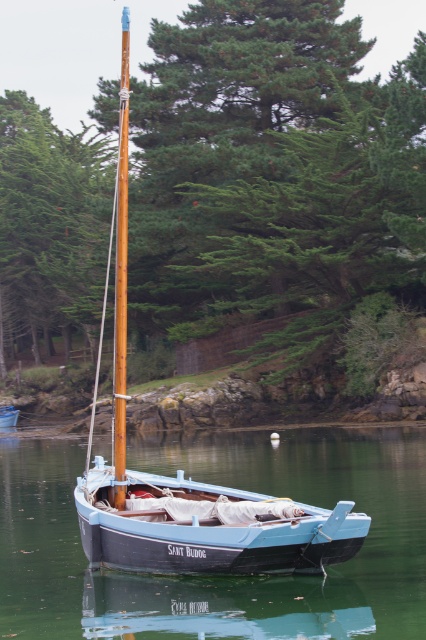
Question: Is the position of green textured tree at upper left less distant than that of wooden mast at center?

Choices:
 (A) yes
 (B) no

Answer: (B)

Question: Which point is farther to the camera?

Choices:
 (A) blue smooth water at center
 (B) blue painted wood boat at center

Answer: (B)

Question: Which object is positioned farthest from the wooden mast at center?

Choices:
 (A) light blue wood sailboat at center
 (B) green textured tree at upper left
 (C) blue smooth water at center

Answer: (B)

Question: Can you confirm if light blue wooden boat at center is thinner than wooden mast at center?

Choices:
 (A) yes
 (B) no

Answer: (A)

Question: Which point is closer to the camera taking this photo?

Choices:
 (A) (8, 419)
 (B) (198, 541)
 (C) (124, 397)
 (D) (402, 579)

Answer: (B)

Question: In this image, where is light blue wooden boat at center located relative to blue painted wood boat at center?

Choices:
 (A) below
 (B) above

Answer: (B)